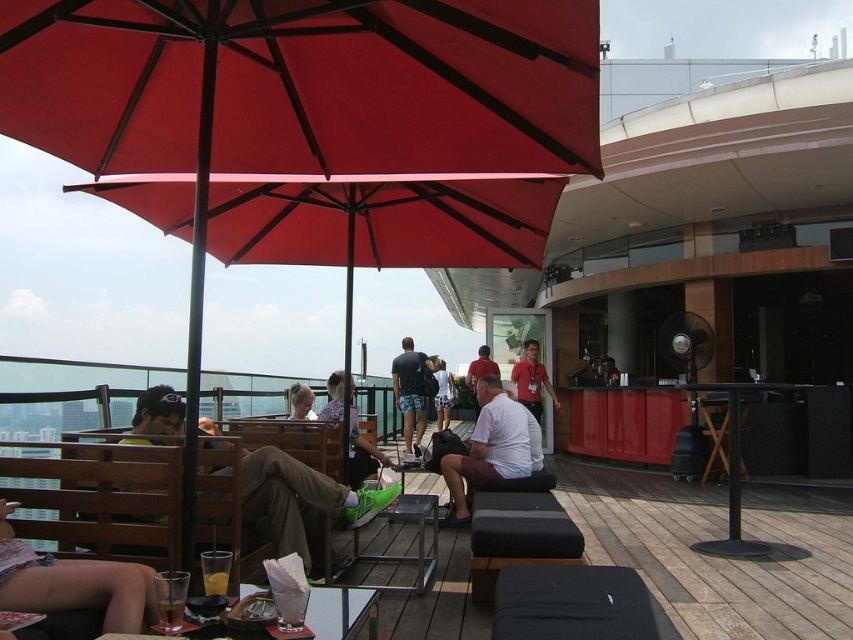
You are a guest at the rooftop bar and want to find a place to sit. You see the wooden deck at center and the red shirt at center. Which object is closer to you?

The wooden deck at center is closer to you because it is in front of the red shirt at center.

You are a photographer trying to capture a photo of the wooden deck at center and the red shirt at center. Which object should you focus on first if you want to include both in your frame without zooming in or out?

The wooden deck at center is smaller than the red shirt at center, so you should focus on the red shirt at center first to ensure it fits properly in the frame.

You are a photographer taking a picture of the rooftop scene. You notice the dark blue shorts at center and the matte red shirt at center. Which object should you focus on first to ensure it appears clearer in the photo?

You should focus on the dark blue shorts at center first because it is closer to the viewer than the matte red shirt at center, so focusing on it will make it clearer in the photo.